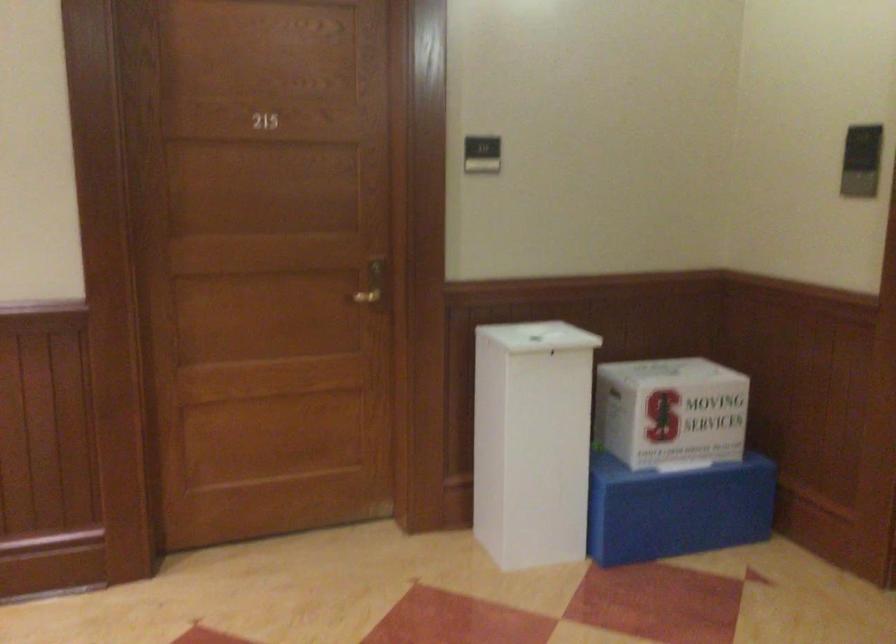
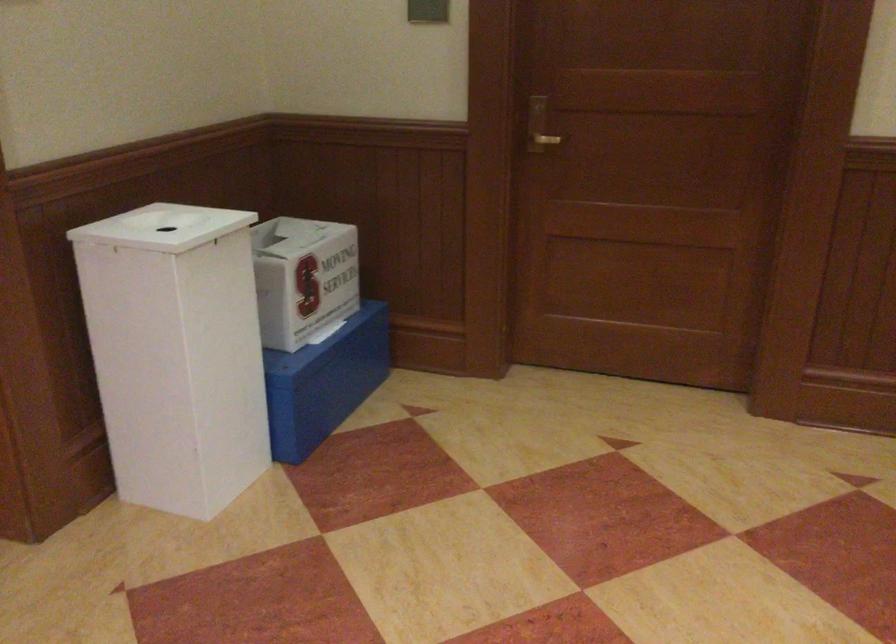
The point at [657,507] is marked in the first image. Where is the corresponding point in the second image?

(323, 382)